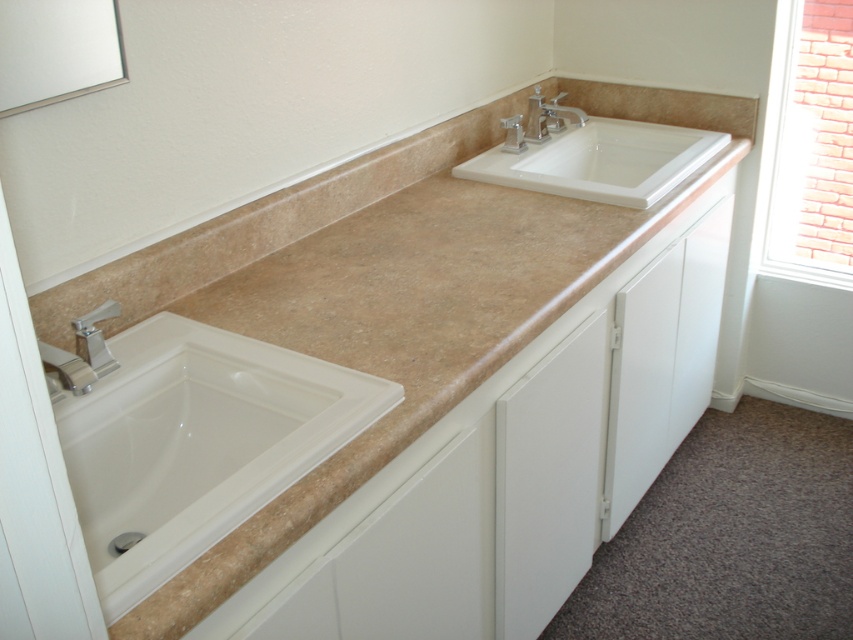
Does beige marble countertop at center appear under silver metallic faucet at upper center?

Indeed, beige marble countertop at center is positioned under silver metallic faucet at upper center.

Looking at this image, who is shorter, beige marble countertop at center or silver metallic faucet at upper center?

Standing shorter between the two is silver metallic faucet at upper center.

Measure the distance between beige marble countertop at center and camera.

They are 32.92 inches apart.

The width and height of the screenshot is (853, 640). In order to click on beige marble countertop at center in this screenshot , I will do `click(386, 292)`.

Who is positioned more to the left, brick wall at upper right or white ceramic sink at upper right?

Positioned to the left is white ceramic sink at upper right.

Is point (769, 208) positioned behind point (492, 164)?

That is True.

Find the location of `brick wall at upper right`. brick wall at upper right is located at coordinates (809, 145).

Who is positioned more to the left, white ceramic sink at upper right or silver metallic faucet at left?

From the viewer's perspective, silver metallic faucet at left appears more on the left side.

The image size is (853, 640). Describe the element at coordinates (619, 144) in the screenshot. I see `white ceramic sink at upper right` at that location.

Is point (641, 166) closer to viewer compared to point (100, 349)?

That is False.

Where is `white ceramic sink at upper right`? white ceramic sink at upper right is located at coordinates (619, 144).